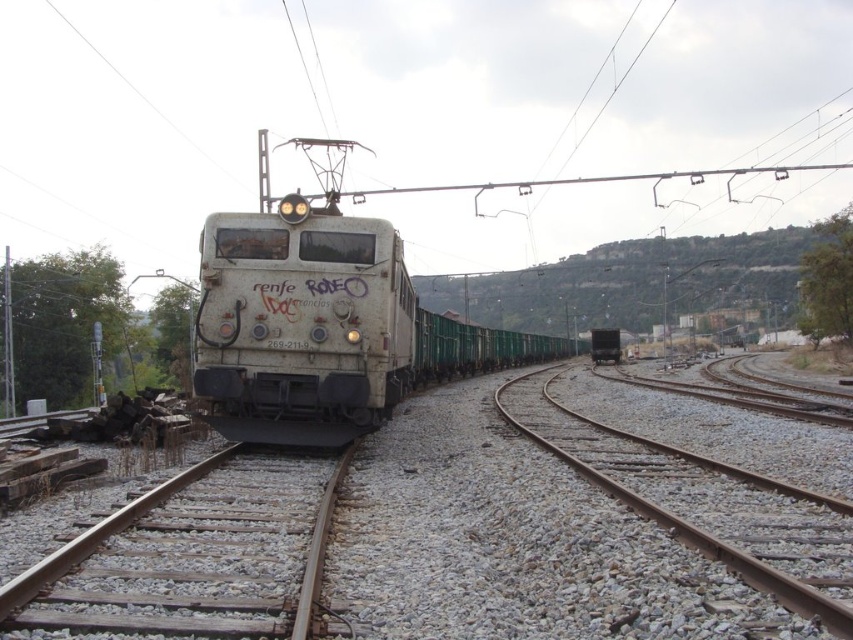
Is point (347, 227) positioned after point (680, 486)?

Yes, point (347, 227) is farther from viewer.

Which of these two, white matte train at center or gray gravel train track at lower right, stands taller?

With more height is white matte train at center.

Locate an element on the screen. This screenshot has height=640, width=853. white matte train at center is located at coordinates (321, 326).

Image resolution: width=853 pixels, height=640 pixels. Identify the location of white matte train at center. (321, 326).